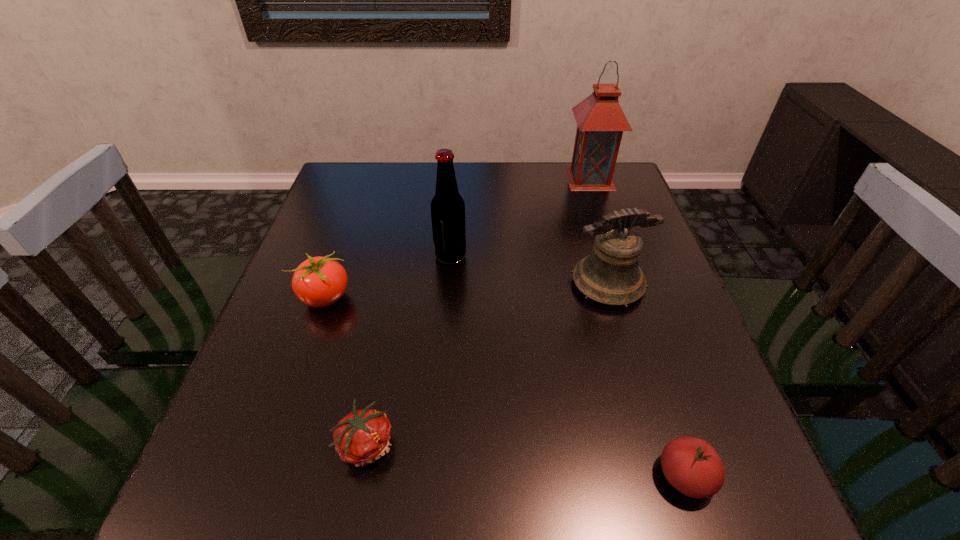
Image resolution: width=960 pixels, height=540 pixels. Find the location of `lantern`. lantern is located at coordinates coord(600,119).

Where is `the farthest object`? the farthest object is located at coordinates (600, 119).

Identify the location of the fourth object from right to left. (447, 206).

Locate an element on the screen. the fifth shortest object is located at coordinates (447, 206).

This screenshot has width=960, height=540. Find the location of `the third tallest object`. the third tallest object is located at coordinates (610, 275).

The image size is (960, 540). What are the coordinates of `the third shortest object` in the screenshot? It's located at (319, 281).

Find the location of a particular element. The width and height of the screenshot is (960, 540). the farthest tomato is located at coordinates tap(319, 281).

What are the coordinates of `the rightmost tomato` in the screenshot? It's located at (691, 465).

You are a GUI agent. You are given a task and a screenshot of the screen. Output one action in this format:
    pyautogui.click(x=<x>, y=<y>)
    Task: Click on the fifth object from right to left
    This screenshot has width=960, height=540.
    Given the screenshot: What is the action you would take?
    pyautogui.click(x=362, y=437)

Identify the location of blank space located 0.370m on the left of the farthest object. This screenshot has height=540, width=960. (x=443, y=179).